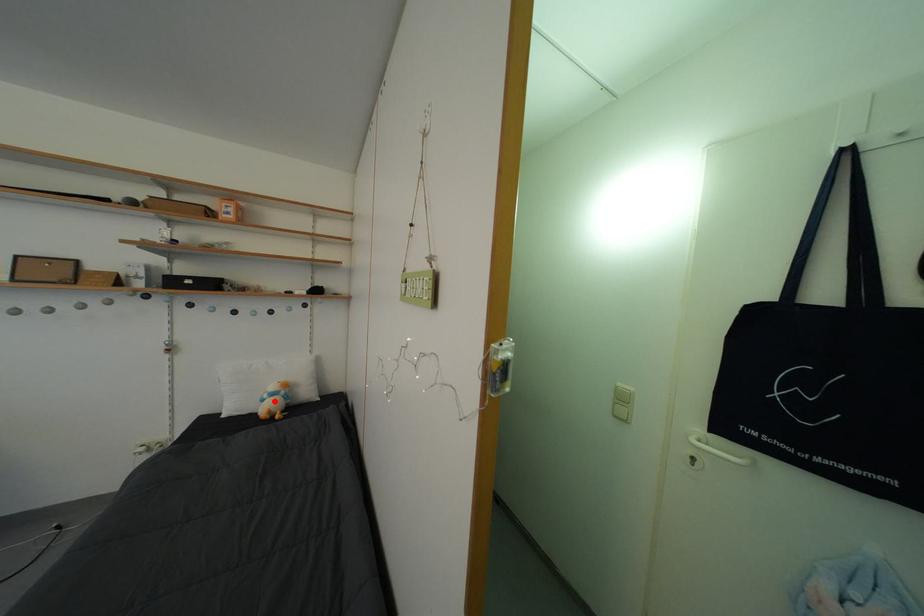
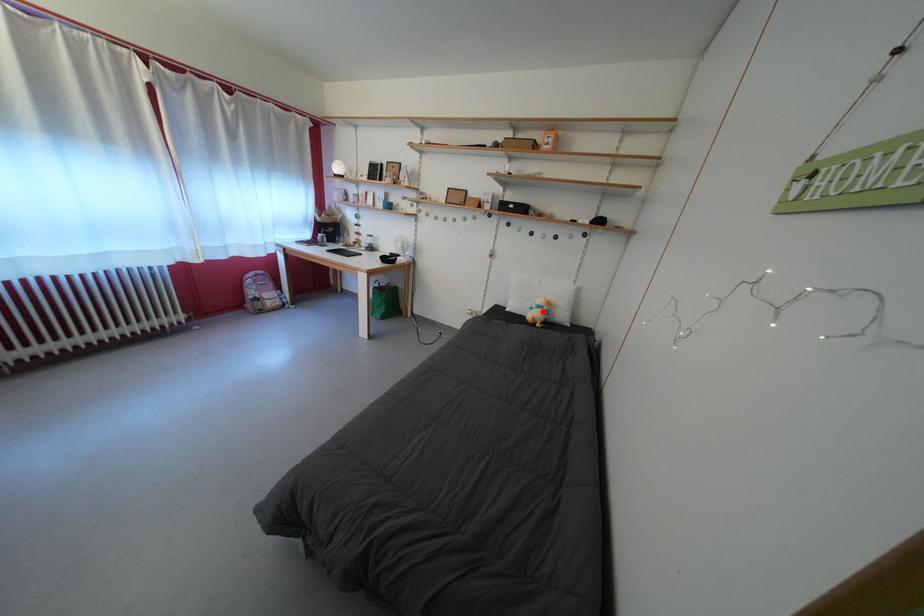
I am providing you with two images of the same scene from different viewpoints. A red point is marked on the first image and another point is marked on the second image. Does the point marked in image1 correspond to the same location as the one in image2?

Yes